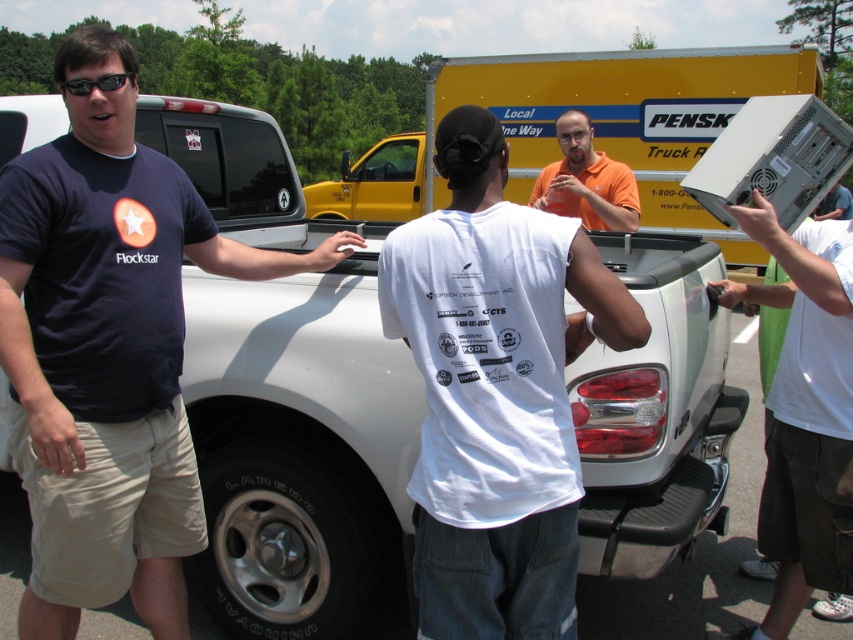
Find the location of a particular element. The width and height of the screenshot is (853, 640). dark blue t-shirt at left is located at coordinates click(108, 349).

Who is taller, dark blue t-shirt at left or black plastic sunglasses at upper left?

With more height is dark blue t-shirt at left.

Between point (97, 458) and point (68, 90), which one is positioned behind?

Point (97, 458)

The image size is (853, 640). In order to click on dark blue t-shirt at left in this screenshot , I will do `click(108, 349)`.

Who is taller, dark blue t-shirt at left or orange matte shirt at center?

Standing taller between the two is dark blue t-shirt at left.

Can you confirm if dark blue t-shirt at left is positioned below orange matte shirt at center?

Yes, dark blue t-shirt at left is below orange matte shirt at center.

Identify the location of dark blue t-shirt at left. (108, 349).

How distant is white cotton t-shirt at center from white matte computer case at right?

white cotton t-shirt at center and white matte computer case at right are 3.48 feet apart.

Is white cotton t-shirt at center positioned in front of white matte computer case at right?

Yes, white cotton t-shirt at center is closer to the viewer.

In order to click on white cotton t-shirt at center in this screenshot , I will do `click(495, 390)`.